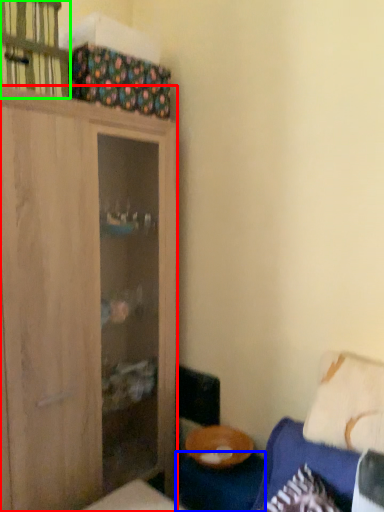
Question: Which object is positioned farthest from cabinetry (highlighted by a red box)? Select from table (highlighted by a blue box) and cabinet (highlighted by a green box).

Choices:
 (A) table
 (B) cabinet

Answer: (A)